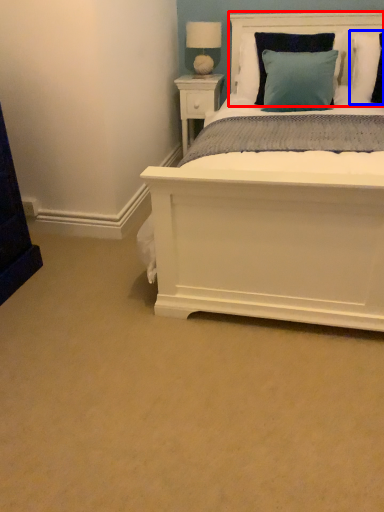
Question: Which object appears farthest to the camera in this image, headboard (highlighted by a red box) or pillow (highlighted by a blue box)?

Choices:
 (A) headboard
 (B) pillow

Answer: (A)